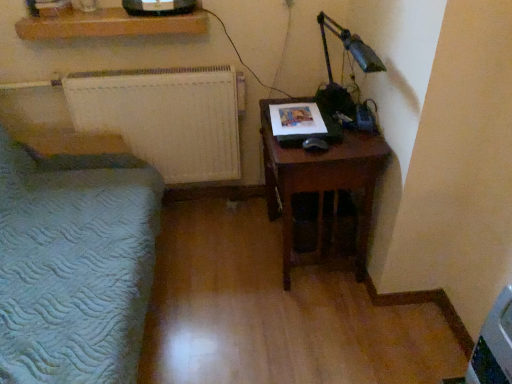
Where is `free location in front of brown wooden nightstand at right`? free location in front of brown wooden nightstand at right is located at coordinates (319, 329).